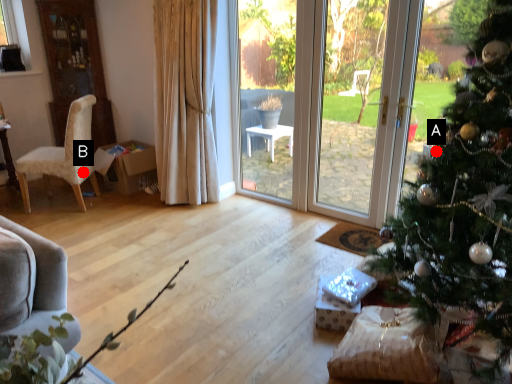
Question: Two points are circled on the image, labeled by A and B beside each circle. Which of the following is the farthest from the observer?

Choices:
 (A) A is further
 (B) B is further

Answer: (B)